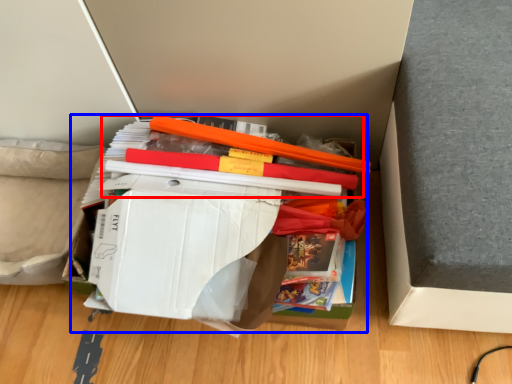
Question: Which object is closer to the camera taking this photo, book (highlighted by a red box) or paperback book (highlighted by a blue box)?

Choices:
 (A) book
 (B) paperback book

Answer: (B)